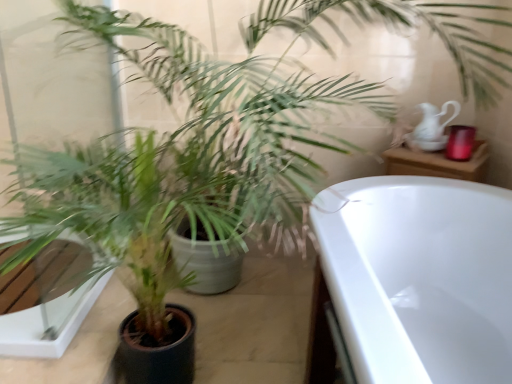
Locate an element on the screen. green matte plant at center is located at coordinates (115, 241).

The width and height of the screenshot is (512, 384). What do you see at coordinates (115, 241) in the screenshot? I see `green matte plant at center` at bounding box center [115, 241].

The width and height of the screenshot is (512, 384). I want to click on white glossy pitcher at upper right, so click(433, 121).

Describe the element at coordinates (433, 121) in the screenshot. I see `white glossy pitcher at upper right` at that location.

Find the location of a particular element. green matte plant at center is located at coordinates (115, 241).

Based on the photo, does green matte plant at center appear on the right side of white glossy pitcher at upper right?

No.

Considering the positions of objects green matte plant at center and white glossy pitcher at upper right in the image provided, who is behind, green matte plant at center or white glossy pitcher at upper right?

white glossy pitcher at upper right.

Does point (102, 199) appear closer or farther from the camera than point (434, 124)?

Point (102, 199).

From the image's perspective, does green matte plant at center appear lower than white glossy pitcher at upper right?

Correct, green matte plant at center appears lower than white glossy pitcher at upper right in the image.

From a real-world perspective, which object rests below the other?

green matte plant at center.

Between green matte plant at center and white glossy pitcher at upper right, which one has larger width?

With larger width is green matte plant at center.

Which of these two, green matte plant at center or white glossy pitcher at upper right, stands shorter?

white glossy pitcher at upper right is shorter.

Who is bigger, green matte plant at center or white glossy pitcher at upper right?

green matte plant at center is bigger.

Would you say green matte plant at center is outside white glossy pitcher at upper right?

Yes, green matte plant at center is outside of white glossy pitcher at upper right.

Consider the image. Is green matte plant at center beside white glossy pitcher at upper right?

No.

Is green matte plant at center positioned with its back to white glossy pitcher at upper right?

No, green matte plant at center is not facing away from white glossy pitcher at upper right.

What's the angular difference between green matte plant at center and white glossy pitcher at upper right's facing directions?

They differ by 28.2 degrees in their facing directions.

Measure the distance from green matte plant at center to white glossy pitcher at upper right.

1.25 meters.

Where is `houseplant on the left of white glossy pitcher at upper right`? houseplant on the left of white glossy pitcher at upper right is located at coordinates (115, 241).

From the picture: Considering the positions of objects white glossy pitcher at upper right and green matte plant at center in the image provided, who is more to the left, white glossy pitcher at upper right or green matte plant at center?

green matte plant at center is more to the left.

Does white glossy pitcher at upper right come behind green matte plant at center?

Yes, the depth of white glossy pitcher at upper right is greater than that of green matte plant at center.

Which is behind, point (457, 109) or point (165, 291)?

The point (457, 109) is farther from the camera.

From the image's perspective, who appears lower, white glossy pitcher at upper right or green matte plant at center?

green matte plant at center is shown below in the image.

Looking at this image, from a real-world perspective, is white glossy pitcher at upper right positioned under green matte plant at center based on gravity?

No, from a real-world perspective, white glossy pitcher at upper right is not under green matte plant at center.

Can you confirm if white glossy pitcher at upper right is thinner than green matte plant at center?

Correct, the width of white glossy pitcher at upper right is less than that of green matte plant at center.

Considering the relative sizes of white glossy pitcher at upper right and green matte plant at center in the image provided, is white glossy pitcher at upper right shorter than green matte plant at center?

Yes, white glossy pitcher at upper right is shorter than green matte plant at center.

Considering the sizes of objects white glossy pitcher at upper right and green matte plant at center in the image provided, who is bigger, white glossy pitcher at upper right or green matte plant at center?

With larger size is green matte plant at center.

Choose the correct answer: Is white glossy pitcher at upper right inside green matte plant at center or outside it?

white glossy pitcher at upper right lies outside green matte plant at center.

Are white glossy pitcher at upper right and green matte plant at center far apart?

white glossy pitcher at upper right is far away from green matte plant at center.

Is white glossy pitcher at upper right positioned with its back to green matte plant at center?

That's not correct — white glossy pitcher at upper right is not looking away from green matte plant at center.

How many degrees apart are the facing directions of white glossy pitcher at upper right and green matte plant at center?

white glossy pitcher at upper right and green matte plant at center are facing 28.2 degrees away from each other.

Find the location of `tea pot above the green matte plant at center (from a real-world perspective)`. tea pot above the green matte plant at center (from a real-world perspective) is located at coordinates (433, 121).

At what (x,y) coordinates should I click in order to perform the action: click on houseplant on the left of white glossy pitcher at upper right. Please return your answer as a coordinate pair (x, y). Looking at the image, I should click on (115, 241).

You are a GUI agent. You are given a task and a screenshot of the screen. Output one action in this format:
    pyautogui.click(x=<x>, y=<y>)
    Task: Click on the tea pot that appears behind the green matte plant at center
    This screenshot has width=512, height=384.
    Given the screenshot: What is the action you would take?
    pyautogui.click(x=433, y=121)